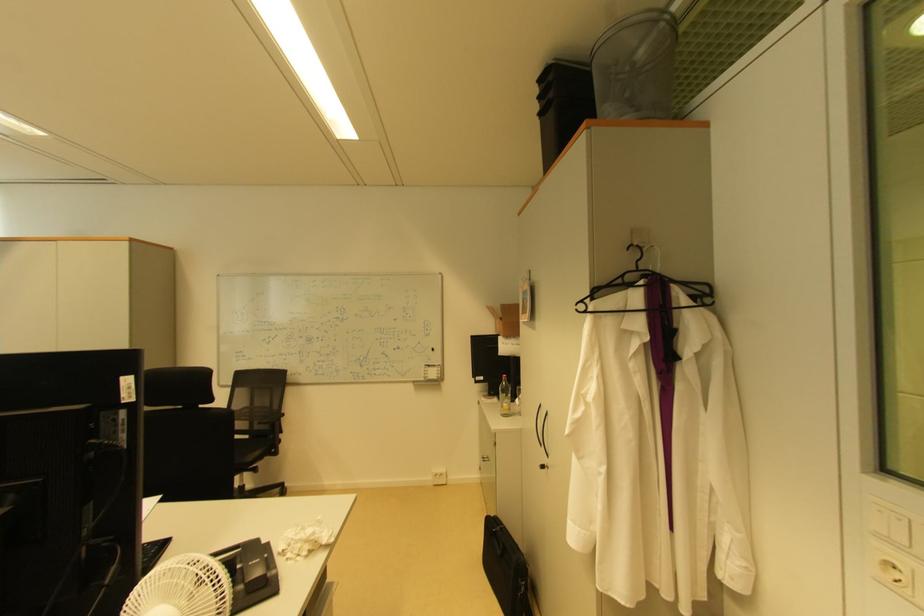
Image resolution: width=924 pixels, height=616 pixels. What do you see at coordinates (505, 397) in the screenshot?
I see `the glass water bottle` at bounding box center [505, 397].